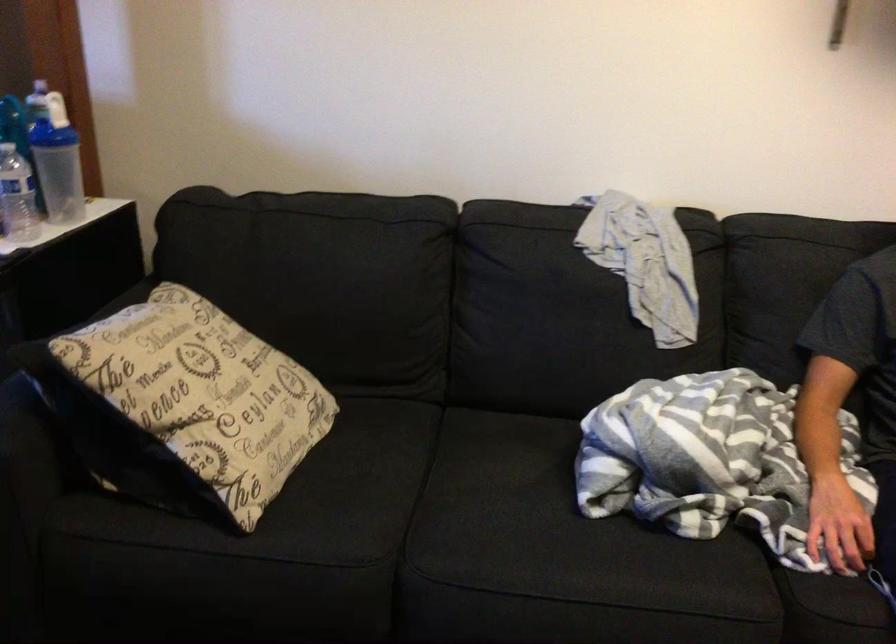
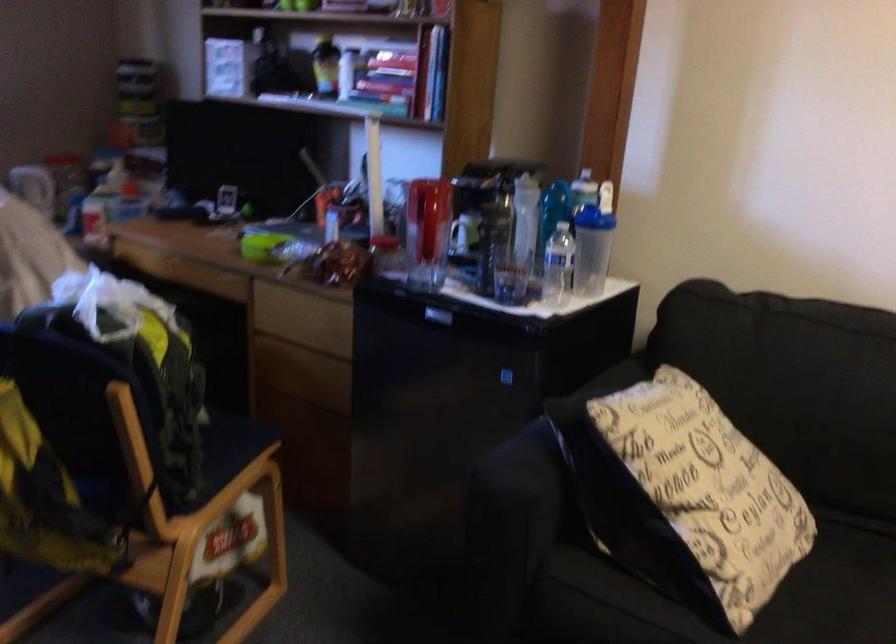
Where in the second image is the point corresponding to pixel 188 411 from the first image?

(694, 496)